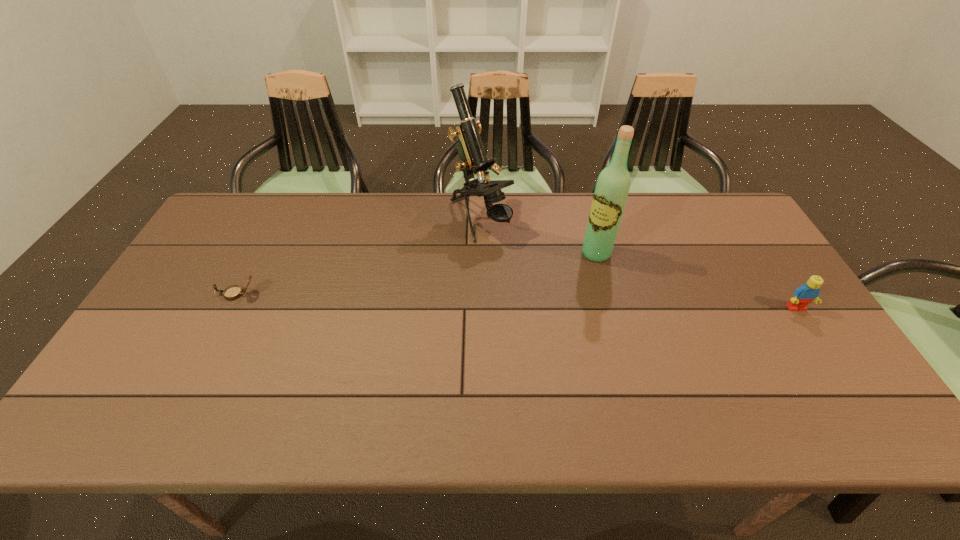
Where is `vacant space situated 0.140m on the front-facing side of the wine bottle`? The height and width of the screenshot is (540, 960). vacant space situated 0.140m on the front-facing side of the wine bottle is located at coordinates (562, 287).

Where is `vacant space situated on the front-facing side of the wine bottle`? This screenshot has width=960, height=540. vacant space situated on the front-facing side of the wine bottle is located at coordinates (534, 313).

Locate an element on the screen. This screenshot has width=960, height=540. blank area located 0.270m on the front-facing side of the wine bottle is located at coordinates (534, 313).

Where is `vacant space located through the eyepiece of the microscope`? Image resolution: width=960 pixels, height=540 pixels. vacant space located through the eyepiece of the microscope is located at coordinates (531, 275).

This screenshot has width=960, height=540. I want to click on blank area located through the eyepiece of the microscope, so click(x=550, y=294).

You are a GUI agent. You are given a task and a screenshot of the screen. Output one action in this format:
    pyautogui.click(x=<x>, y=<y>)
    Task: Click on the free region located through the eyepiece of the microscope
    
    Given the screenshot: What is the action you would take?
    pyautogui.click(x=524, y=268)

In order to click on object situated at the far edge in this screenshot , I will do `click(473, 158)`.

Locate an element on the screen. The width and height of the screenshot is (960, 540). object at the left edge is located at coordinates (232, 292).

Find the location of `object present at the right edge`. object present at the right edge is located at coordinates (803, 295).

Identify the location of vacant space at the far edge of the desktop. This screenshot has width=960, height=540. (316, 220).